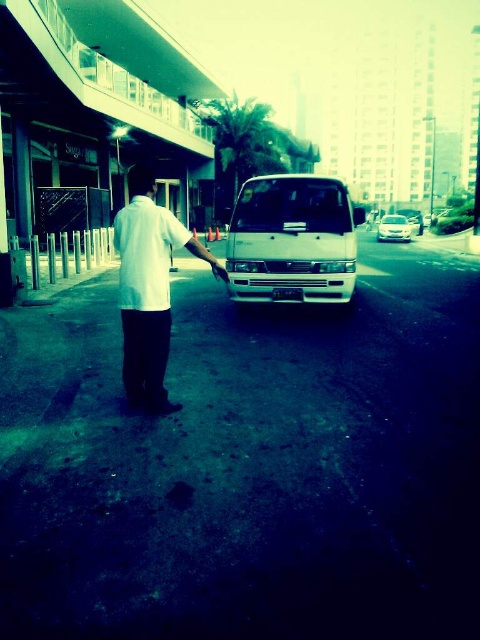
Between white matte van at center and white matte shirt at center, which one has less height?

white matte shirt at center is shorter.

The height and width of the screenshot is (640, 480). In order to click on white matte van at center in this screenshot , I will do `click(292, 241)`.

The width and height of the screenshot is (480, 640). Describe the element at coordinates (292, 241) in the screenshot. I see `white matte van at center` at that location.

Identify the location of white matte van at center. This screenshot has height=640, width=480. (292, 241).

Between point (144, 173) and point (408, 221), which one is positioned behind?

Positioned behind is point (408, 221).

The height and width of the screenshot is (640, 480). What do you see at coordinates (148, 289) in the screenshot? I see `white matte shirt at center` at bounding box center [148, 289].

The image size is (480, 640). I want to click on white matte shirt at center, so click(x=148, y=289).

Locate an element on the screen. Image resolution: width=480 pixels, height=640 pixels. white matte shirt at center is located at coordinates (148, 289).

Looking at this image, can you confirm if white cotton shirt at center is smaller than metallic silver van at center?

Yes, white cotton shirt at center is smaller than metallic silver van at center.

Between point (140, 211) and point (381, 225), which one is positioned behind?

Point (381, 225)

Who is more forward, (155, 232) or (391, 214)?

Point (155, 232)

You are a GUI agent. You are given a task and a screenshot of the screen. Output one action in this format:
    pyautogui.click(x=<x>, y=<y>)
    Task: Click on the white cotton shirt at center
    
    Given the screenshot: What is the action you would take?
    pyautogui.click(x=145, y=253)